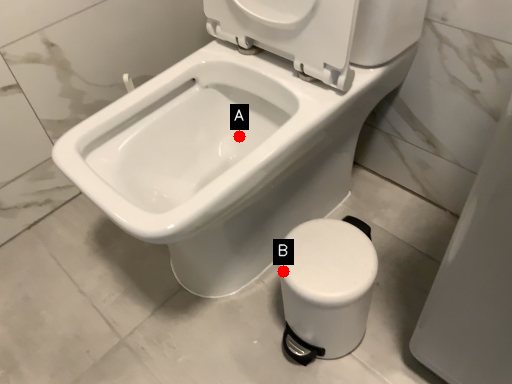
Question: Two points are circled on the image, labeled by A and B beside each circle. Which point is farther to the camera?

Choices:
 (A) A is further
 (B) B is further

Answer: (A)